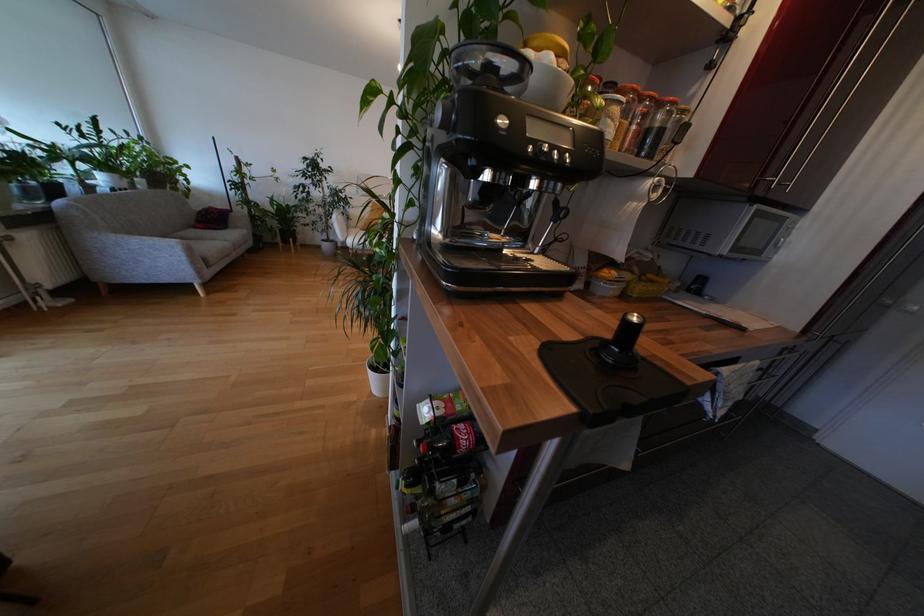
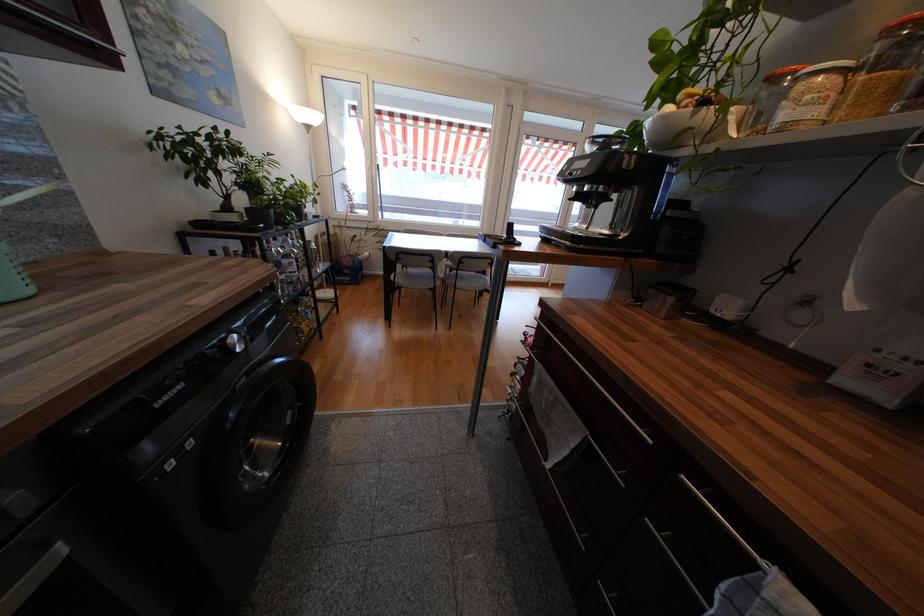
The point at (483, 180) is marked in the first image. Where is the corresponding point in the second image?

(581, 193)